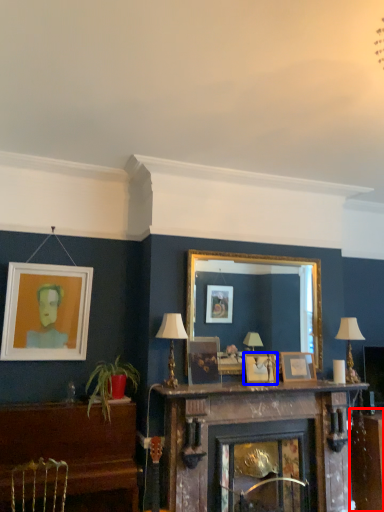
Question: Among these objects, which one is nearest to the camera, table (highlighted by a red box) or picture frame (highlighted by a blue box)?

Choices:
 (A) table
 (B) picture frame

Answer: (B)